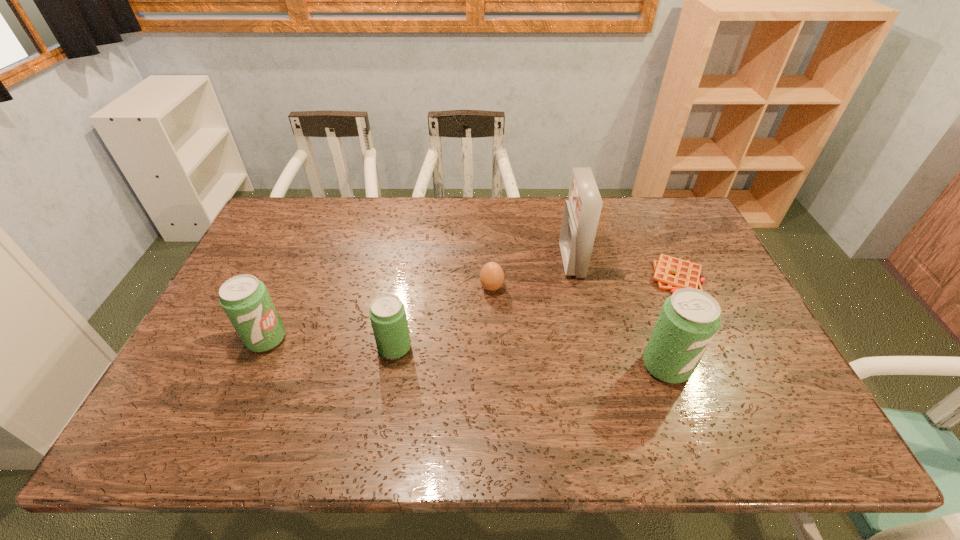
The image size is (960, 540). I want to click on free space between the leftmost soda and the shortest soda, so click(330, 343).

The width and height of the screenshot is (960, 540). Identify the location of free space that is in between the waffle and the second shortest object. (584, 282).

The width and height of the screenshot is (960, 540). Find the location of `vacant area between the tallest object and the second object from left to right`. vacant area between the tallest object and the second object from left to right is located at coordinates (483, 305).

Where is `free space between the rightmost soda and the third object from right to left`? The height and width of the screenshot is (540, 960). free space between the rightmost soda and the third object from right to left is located at coordinates (619, 314).

The height and width of the screenshot is (540, 960). I want to click on vacant area between the third tallest object and the shortest object, so click(471, 308).

Find the location of a particular element. The width and height of the screenshot is (960, 540). the fourth closest object relative to the fourth shortest object is located at coordinates (689, 319).

Locate an element on the screen. This screenshot has width=960, height=540. object that is the closest to the boiled egg is located at coordinates pos(582,210).

At what (x,y) coordinates should I click in order to perform the action: click on soda that stands as the second closest to the rightmost soda. Please return your answer as a coordinate pair (x, y). Image resolution: width=960 pixels, height=540 pixels. Looking at the image, I should click on (245, 299).

You are a GUI agent. You are given a task and a screenshot of the screen. Output one action in this format:
    pyautogui.click(x=<x>, y=<y>)
    Task: Click on the soda that is the closest to the shortest soda
    The image size is (960, 540).
    Given the screenshot: What is the action you would take?
    pyautogui.click(x=245, y=299)

This screenshot has height=540, width=960. Find the location of `free space that satisfies the following two spatial constraints: 1. on the front-facing side of the first-aid kit; 2. on the right side of the waffle`. free space that satisfies the following two spatial constraints: 1. on the front-facing side of the first-aid kit; 2. on the right side of the waffle is located at coordinates (575, 277).